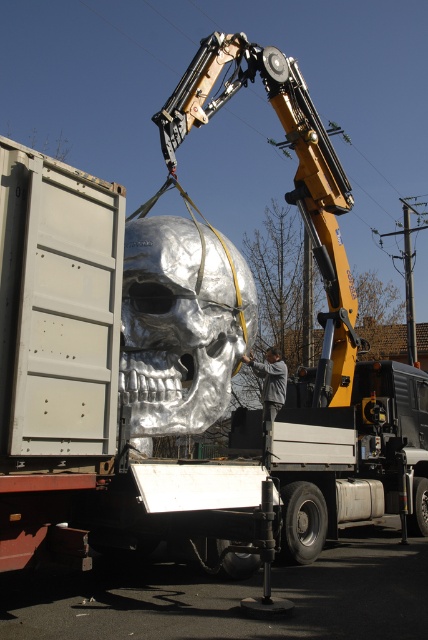
Question: Does silver metallic skull at center appear on the left side of gray fabric jacket at center?

Choices:
 (A) no
 (B) yes

Answer: (B)

Question: Among these points, which one is farthest from the camera?

Choices:
 (A) (217, 538)
 (B) (270, 419)

Answer: (B)

Question: Which point is closer to the camera?

Choices:
 (A) (225, 376)
 (B) (272, 408)

Answer: (A)

Question: From the image, what is the correct spatial relationship of silver metallic skull at center in relation to gray fabric jacket at center?

Choices:
 (A) left
 (B) right

Answer: (A)

Question: Among these objects, which one is farthest from the camera?

Choices:
 (A) gray fabric jacket at center
 (B) shiny metallic skull at center
 (C) silver metallic skull at center

Answer: (A)

Question: Can you confirm if silver metallic skull at center is positioned to the left of shiny metallic skull at center?

Choices:
 (A) yes
 (B) no

Answer: (A)